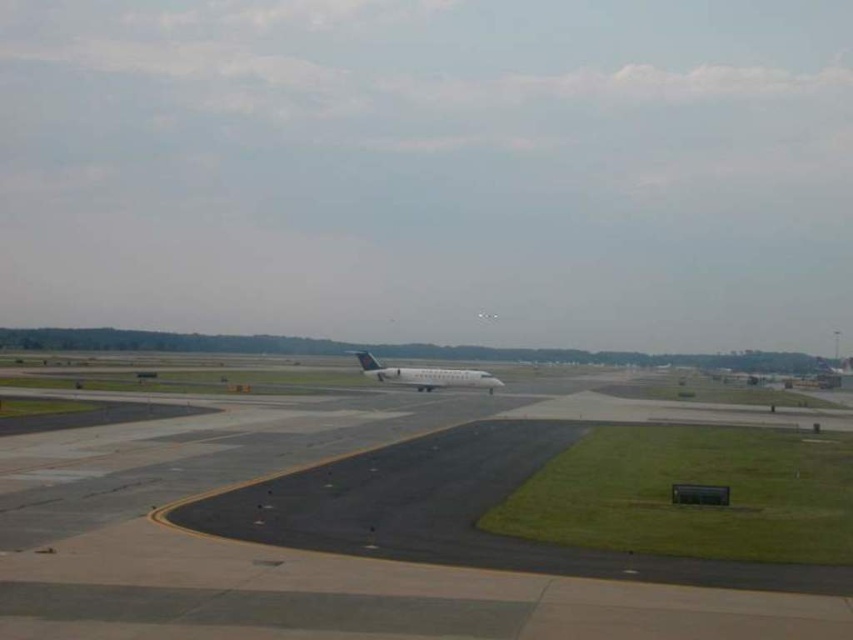
Question: Which object appears farthest from the camera in this image?

Choices:
 (A) white matte airplane at center
 (B) black asphalt tarmac at center

Answer: (A)

Question: Does black asphalt tarmac at center appear on the left side of white matte airplane at center?

Choices:
 (A) yes
 (B) no

Answer: (A)

Question: Which point appears farthest from the camera in this image?

Choices:
 (A) (36, 592)
 (B) (427, 371)

Answer: (B)

Question: Is black asphalt tarmac at center closer to camera compared to white matte airplane at center?

Choices:
 (A) yes
 (B) no

Answer: (A)

Question: Which point appears closest to the camera in this image?

Choices:
 (A) (369, 369)
 (B) (637, 621)

Answer: (B)

Question: Can you confirm if black asphalt tarmac at center is positioned to the right of white matte airplane at center?

Choices:
 (A) no
 (B) yes

Answer: (A)